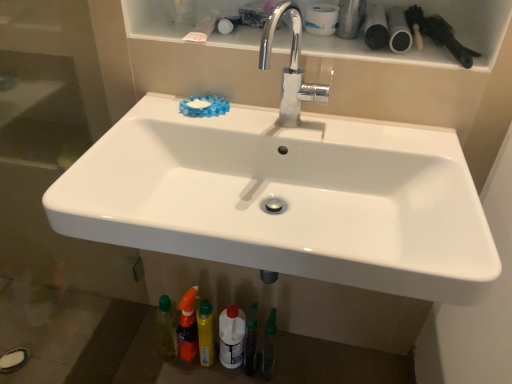
Question: Considering the relative sizes of translucent orange spray bottle at lower center, the first toiletry from the left, and chrome metallic faucet at upper center in the image provided, is translucent orange spray bottle at lower center, the first toiletry from the left, shorter than chrome metallic faucet at upper center?

Choices:
 (A) no
 (B) yes

Answer: (A)

Question: From the image's perspective, is translucent orange spray bottle at lower center, the first toiletry from the left, located beneath chrome metallic faucet at upper center?

Choices:
 (A) no
 (B) yes

Answer: (B)

Question: Is the position of translucent orange spray bottle at lower center, the first toiletry from the left, less distant than that of chrome metallic faucet at upper center?

Choices:
 (A) yes
 (B) no

Answer: (B)

Question: From the image's perspective, would you say translucent orange spray bottle at lower center, the second toiletry positioned from the right, is positioned over chrome metallic faucet at upper center?

Choices:
 (A) no
 (B) yes

Answer: (A)

Question: Considering the relative sizes of translucent orange spray bottle at lower center, the second toiletry positioned from the right, and chrome metallic faucet at upper center in the image provided, is translucent orange spray bottle at lower center, the second toiletry positioned from the right, wider than chrome metallic faucet at upper center?

Choices:
 (A) yes
 (B) no

Answer: (B)

Question: Based on their positions, is white glossy shelf at upper center located to the left or right of chrome metallic faucet at upper center?

Choices:
 (A) left
 (B) right

Answer: (B)

Question: From the image's perspective, is white glossy shelf at upper center positioned above or below chrome metallic faucet at upper center?

Choices:
 (A) below
 (B) above

Answer: (B)

Question: Is white glossy shelf at upper center situated inside chrome metallic faucet at upper center or outside?

Choices:
 (A) outside
 (B) inside

Answer: (A)

Question: Does point (303, 66) appear closer or farther from the camera than point (291, 51)?

Choices:
 (A) closer
 (B) farther

Answer: (A)

Question: From the image's perspective, is white glossy sink at center above or below white matte toilet paper at upper center?

Choices:
 (A) below
 (B) above

Answer: (A)

Question: In terms of size, does white glossy sink at center appear bigger or smaller than white matte toilet paper at upper center?

Choices:
 (A) small
 (B) big

Answer: (B)

Question: Is white glossy sink at center to the left or to the right of white matte toilet paper at upper center in the image?

Choices:
 (A) right
 (B) left

Answer: (B)

Question: Considering the positions of white glossy sink at center and white matte toilet paper at upper center in the image, is white glossy sink at center taller or shorter than white matte toilet paper at upper center?

Choices:
 (A) tall
 (B) short

Answer: (A)

Question: Considering the positions of black matte brush at upper right and white matte toilet paper at upper center in the image, is black matte brush at upper right wider or thinner than white matte toilet paper at upper center?

Choices:
 (A) thin
 (B) wide

Answer: (B)

Question: In the image, is black matte brush at upper right positioned in front of or behind white matte toilet paper at upper center?

Choices:
 (A) behind
 (B) front

Answer: (B)